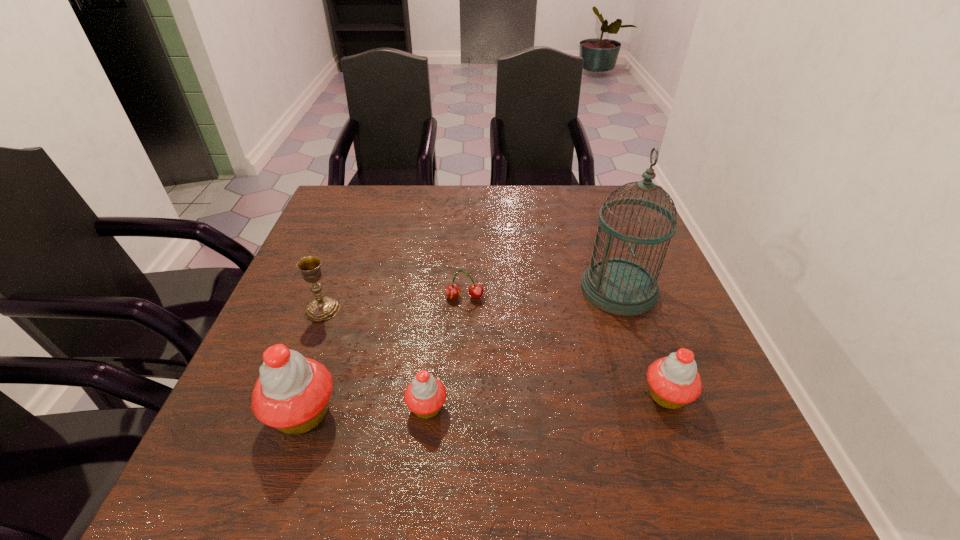
If the aim is uniform spacing by inserting an additional cupcake among them, please point to a vacant space for this new cupcake. Please provide its 2D coordinates. Your answer should be formatted as a tuple, i.e. [(x, y)], where the tuple contains the x and y coordinates of a point satisfying the conditions above.

[(548, 401)]